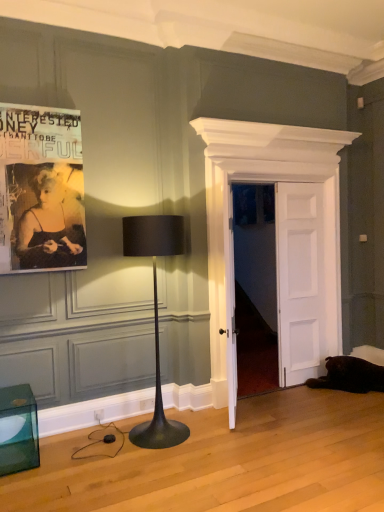
The image size is (384, 512). Identify the location of empty space that is ontop of white wooden door at center, the first door when ordered from left to right. pyautogui.click(x=278, y=160).